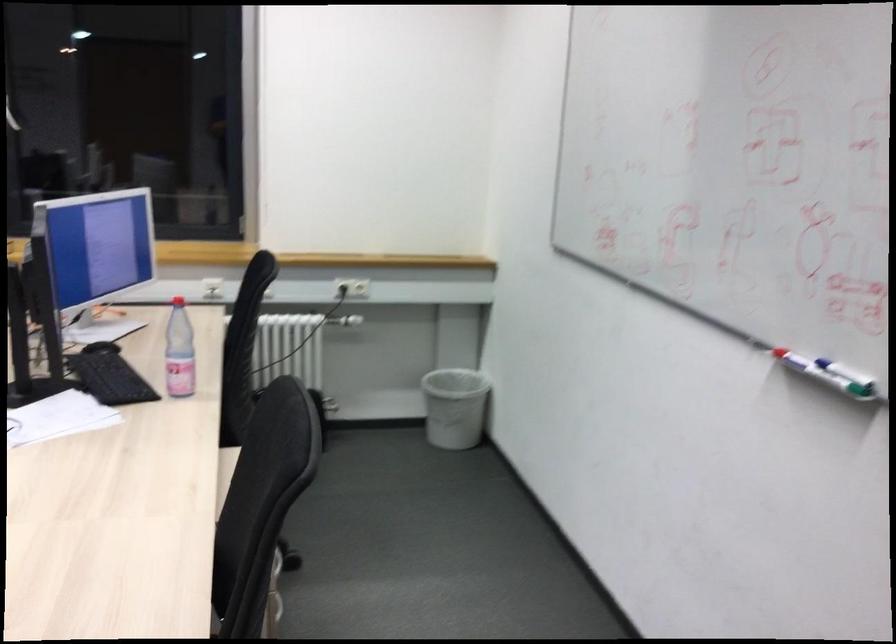
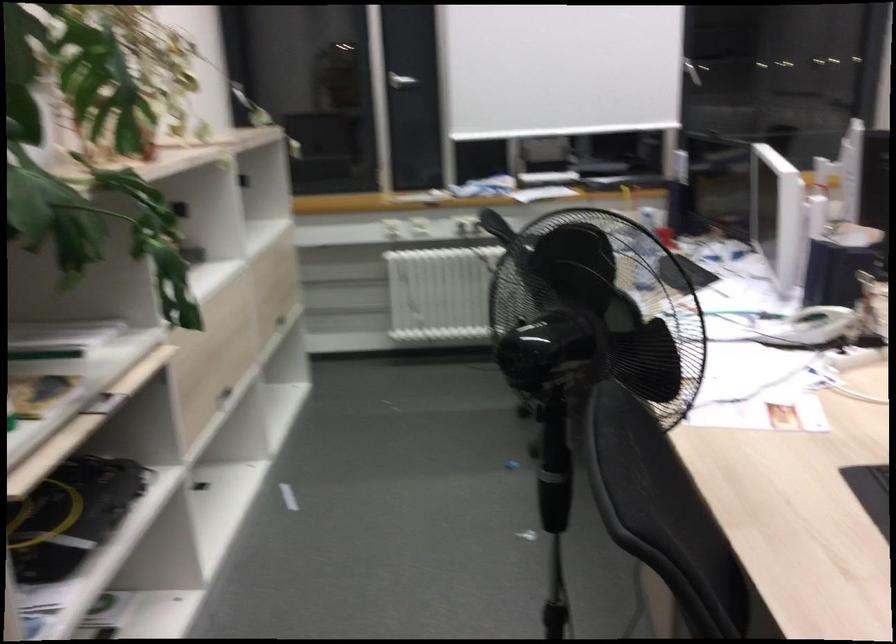
Based on the photo, which direction would the cameraman need to move to produce the second image?

The cameraman moved toward left, backward.